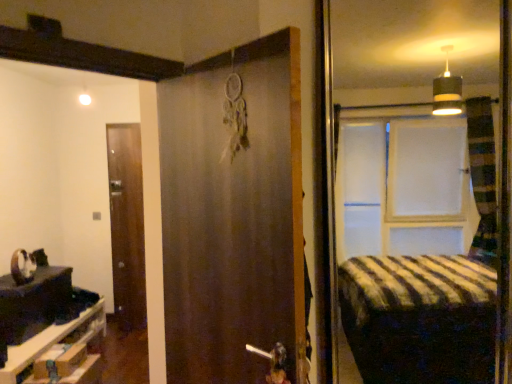
Question: Considering the positions of brown matte door at center, marked as the second door in a left-to-right arrangement, and brown wooden door at left, positioned as the 1th door in back-to-front order, in the image, is brown matte door at center, marked as the second door in a left-to-right arrangement, bigger or smaller than brown wooden door at left, positioned as the 1th door in back-to-front order,?

Choices:
 (A) big
 (B) small

Answer: (A)

Question: Considering the positions of point (294, 233) and point (119, 249), is point (294, 233) closer or farther from the camera than point (119, 249)?

Choices:
 (A) closer
 (B) farther

Answer: (A)

Question: Estimate the real-world distances between objects in this image. Which object is closer to the brown wooden door at left, which is counted as the first door, starting from the left?

Choices:
 (A) wooden drawer at lower left
 (B) brown matte door at center, marked as the second door in a left-to-right arrangement
 (C) black glossy table at lower left

Answer: (C)

Question: Which is nearer to the brown matte door at center, the 1th door in the front-to-back sequence?

Choices:
 (A) black glossy table at lower left
 (B) wooden drawer at lower left
 (C) brown wooden door at left, which is counted as the first door, starting from the left

Answer: (B)